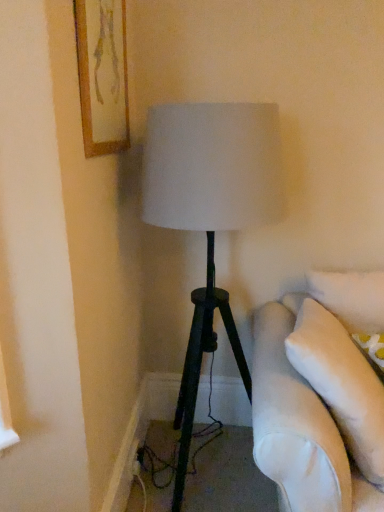
Question: Is black plastic outlet at lower left closer to camera compared to wooden framed artwork at upper left?

Choices:
 (A) no
 (B) yes

Answer: (A)

Question: Is the position of black plastic outlet at lower left more distant than that of wooden framed artwork at upper left?

Choices:
 (A) no
 (B) yes

Answer: (B)

Question: Is black plastic outlet at lower left not inside wooden framed artwork at upper left?

Choices:
 (A) yes
 (B) no

Answer: (A)

Question: Considering the relative sizes of black plastic outlet at lower left and wooden framed artwork at upper left in the image provided, is black plastic outlet at lower left bigger than wooden framed artwork at upper left?

Choices:
 (A) yes
 (B) no

Answer: (B)

Question: Is black plastic outlet at lower left to the left of wooden framed artwork at upper left from the viewer's perspective?

Choices:
 (A) yes
 (B) no

Answer: (B)

Question: Can you confirm if black plastic outlet at lower left is positioned to the right of wooden framed artwork at upper left?

Choices:
 (A) yes
 (B) no

Answer: (A)

Question: Would you say wooden framed artwork at upper left is a long distance from black plastic outlet at lower left?

Choices:
 (A) no
 (B) yes

Answer: (B)

Question: Is wooden framed artwork at upper left looking in the opposite direction of black plastic outlet at lower left?

Choices:
 (A) no
 (B) yes

Answer: (A)

Question: From a real-world perspective, is wooden framed artwork at upper left under black plastic outlet at lower left?

Choices:
 (A) no
 (B) yes

Answer: (A)

Question: Is wooden framed artwork at upper left further to the viewer compared to black plastic outlet at lower left?

Choices:
 (A) yes
 (B) no

Answer: (B)

Question: Is wooden framed artwork at upper left positioned in front of black plastic outlet at lower left?

Choices:
 (A) yes
 (B) no

Answer: (A)

Question: Does wooden framed artwork at upper left have a greater width compared to black plastic outlet at lower left?

Choices:
 (A) yes
 (B) no

Answer: (A)

Question: From a real-world perspective, is wooden framed artwork at upper left above or below black plastic outlet at lower left?

Choices:
 (A) above
 (B) below

Answer: (A)